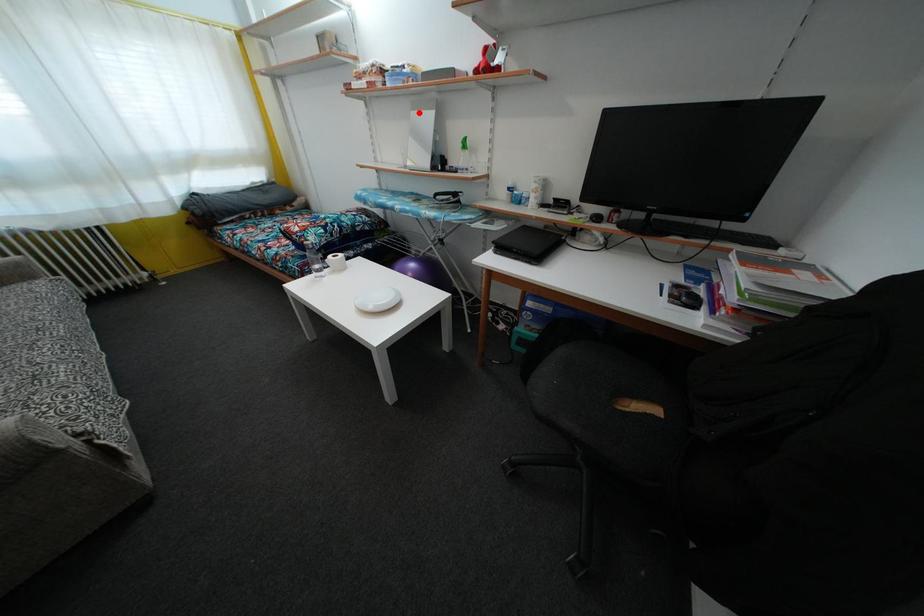
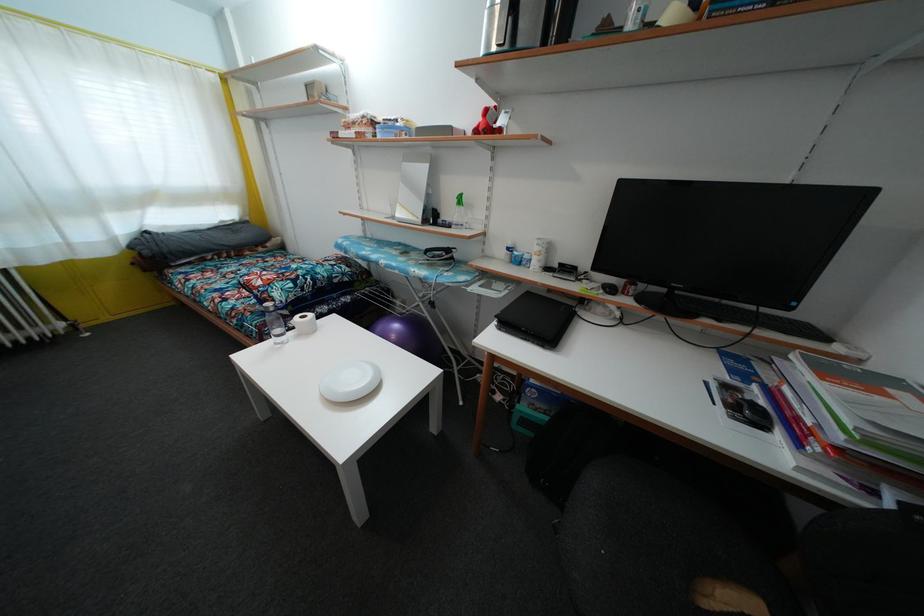
The point at the highlighted location is marked in the first image. Where is the corresponding point in the second image?

(410, 164)